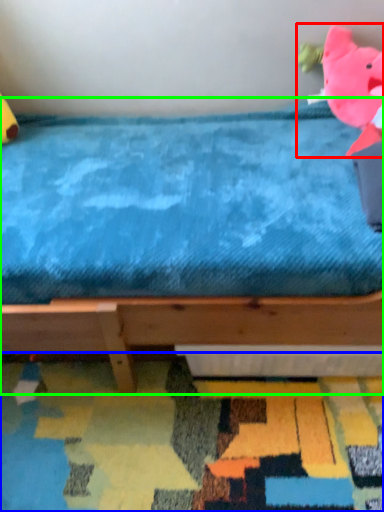
Question: Which object is positioned farthest from toy (highlighted by a red box)? Select from mat (highlighted by a blue box) and bed (highlighted by a green box).

Choices:
 (A) mat
 (B) bed

Answer: (A)